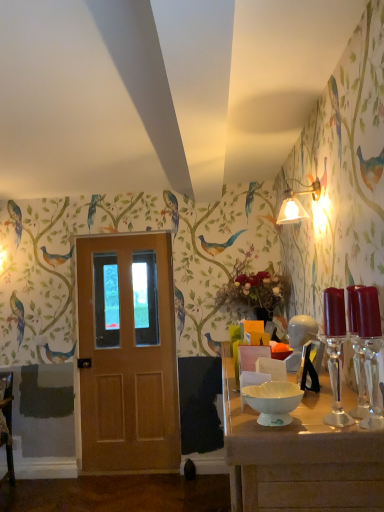
Locate an element on the screen. empty space that is ontop of white glossy bowl at center (from a real-world perspective) is located at coordinates [272, 390].